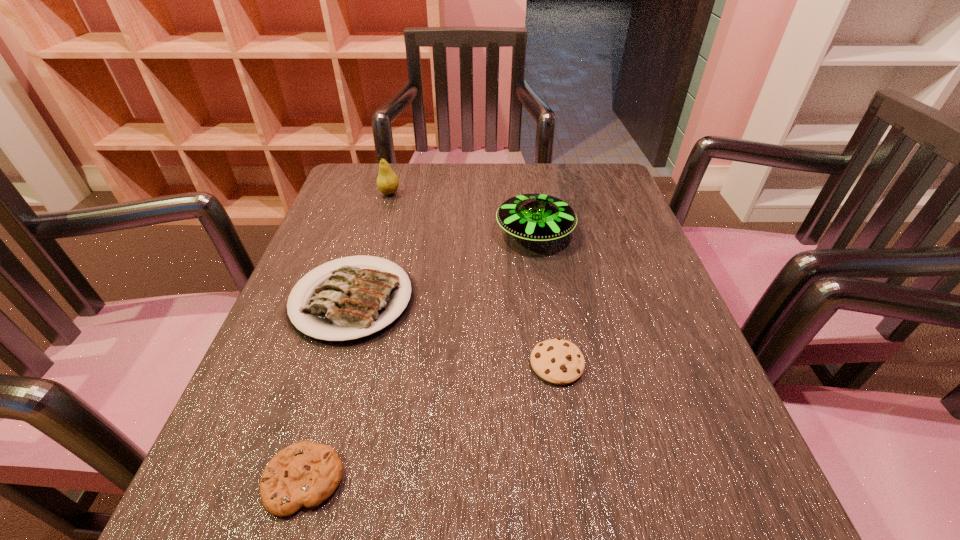
This screenshot has height=540, width=960. Identify the location of vacant region between the tallest object and the farther cookie. (473, 279).

Identify the location of vacant area that lies between the second tallest object and the farther cookie. (545, 299).

The image size is (960, 540). Identify the location of free space between the plate and the farther cookie. (454, 332).

Image resolution: width=960 pixels, height=540 pixels. What are the coordinates of `vacant region between the plate and the farthest object` in the screenshot? It's located at (371, 247).

Find the location of `empty location between the farther cookie and the saucer`. empty location between the farther cookie and the saucer is located at coordinates (545, 299).

At what (x,y) coordinates should I click in order to perform the action: click on free space between the farthest object and the fourth shortest object. Please return your answer as a coordinate pair (x, y). Looking at the image, I should click on (462, 213).

At what (x,y) coordinates should I click in order to perform the action: click on empty space between the tallest object and the second tallest object. Please return your answer as a coordinate pair (x, y). The height and width of the screenshot is (540, 960). Looking at the image, I should click on (462, 213).

Locate an element on the screen. Image resolution: width=960 pixels, height=540 pixels. object that is the closest to the plate is located at coordinates (534, 217).

I want to click on object that is the fourth closest to the pear, so click(x=306, y=473).

The image size is (960, 540). Identify the location of free spot that satisfies the following two spatial constraints: 1. on the back side of the tallest object; 2. on the right side of the plate. (384, 193).